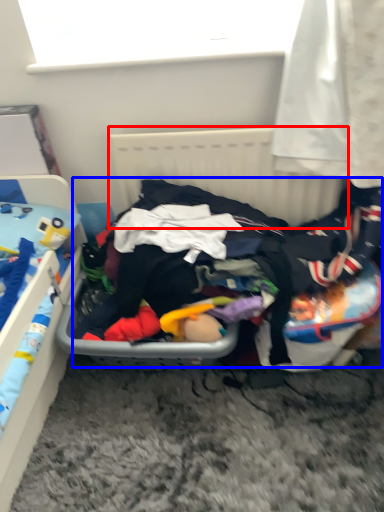
Question: Which point is further to the camera, radiator (highlighted by a red box) or clothing (highlighted by a blue box)?

Choices:
 (A) radiator
 (B) clothing

Answer: (A)